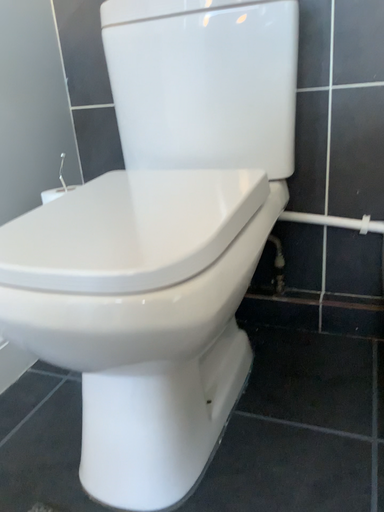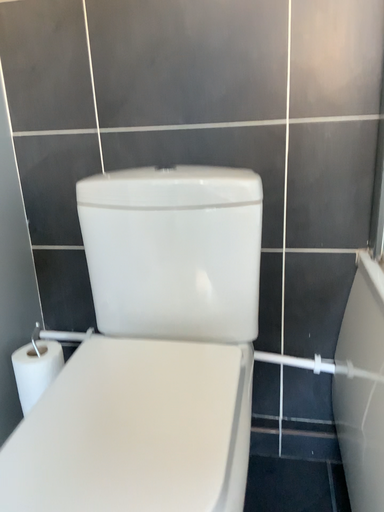
Question: Which way did the camera rotate in the video?

Choices:
 (A) rotated left
 (B) rotated right

Answer: (B)